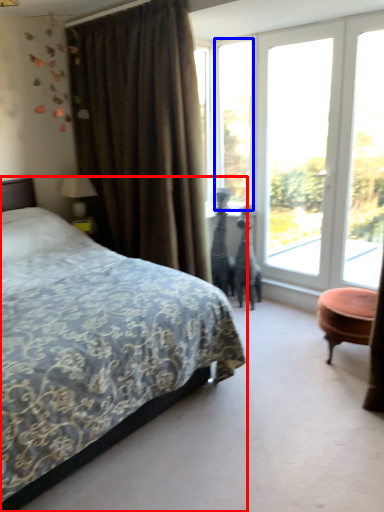
Question: Which object appears farthest to the camera in this image, bed (highlighted by a red box) or window (highlighted by a blue box)?

Choices:
 (A) bed
 (B) window

Answer: (B)